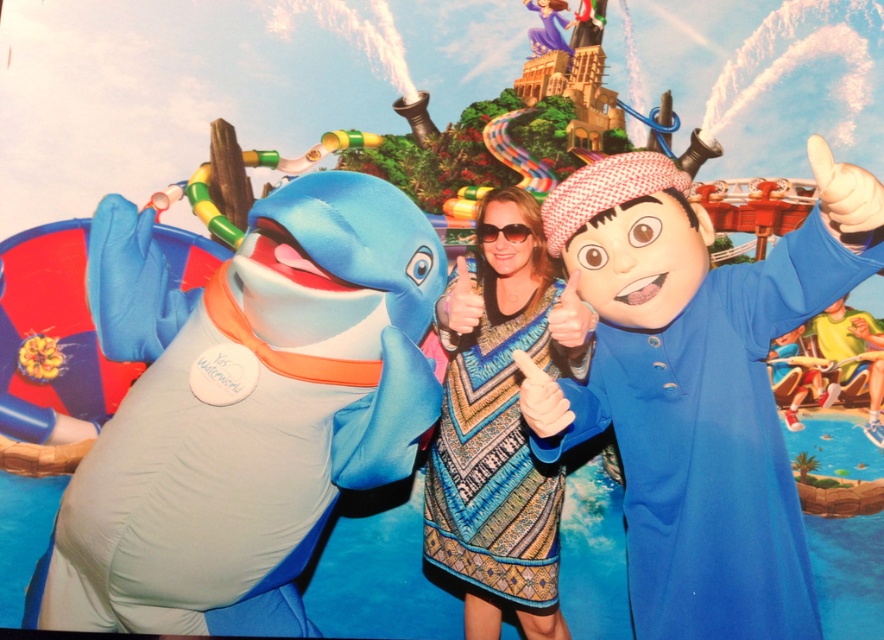
Question: Is blue matte costume at right further to the viewer compared to patterned fabric dress at center?

Choices:
 (A) no
 (B) yes

Answer: (A)

Question: Which object is closer to the camera taking this photo?

Choices:
 (A) blue matte costume at right
 (B) patterned fabric dress at center

Answer: (A)

Question: Is blue matte costume at right bigger than patterned fabric dress at center?

Choices:
 (A) no
 (B) yes

Answer: (B)

Question: Can you confirm if blue matte costume at right is smaller than patterned fabric dress at center?

Choices:
 (A) no
 (B) yes

Answer: (A)

Question: Which object appears farthest from the camera in this image?

Choices:
 (A) blue matte costume at right
 (B) patterned fabric dress at center

Answer: (B)